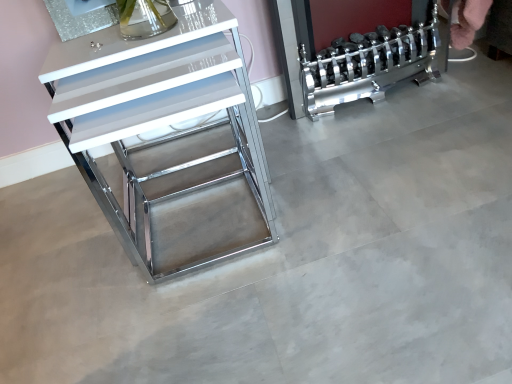
You are a GUI agent. You are given a task and a screenshot of the screen. Output one action in this format:
    pyautogui.click(x=<x>, y=<y>)
    Task: Click on the vacant space in front of white glossy drawer at left
    The image size is (512, 384).
    Given the screenshot: What is the action you would take?
    pyautogui.click(x=237, y=303)